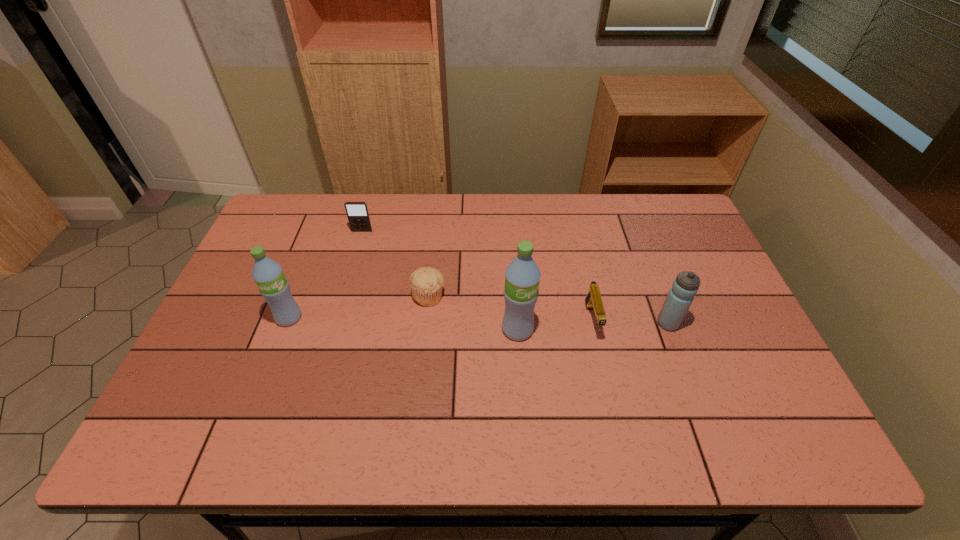
Where is `vacant space that is in between the pistol and the rightmost water bottle`? The height and width of the screenshot is (540, 960). vacant space that is in between the pistol and the rightmost water bottle is located at coordinates (630, 322).

Where is `object that is the closest to the iPod`? The width and height of the screenshot is (960, 540). object that is the closest to the iPod is located at coordinates (426, 283).

At what (x,y) coordinates should I click in order to perform the action: click on the closest object to the farthest object. Please return your answer as a coordinate pair (x, y). Looking at the image, I should click on (426, 283).

What are the coordinates of `water bottle that can be found as the closest to the leftmost object` in the screenshot? It's located at (522, 276).

Identify which water bottle is the third closest to the fourth object from right to left. Please provide its 2D coordinates. Your answer should be formatted as a tuple, i.e. [(x, y)], where the tuple contains the x and y coordinates of a point satisfying the conditions above.

[(681, 295)]

I want to click on blank area in the image that satisfies the following two spatial constraints: 1. on the front-facing side of the fourth object from right to left; 2. on the left side of the third shortest object, so click(x=344, y=295).

Identify the location of blank area in the image that satisfies the following two spatial constraints: 1. on the front-facing side of the second water bottle from left to right; 2. on the left side of the fourth tallest object. (334, 329).

This screenshot has width=960, height=540. I want to click on free spot that satisfies the following two spatial constraints: 1. on the front-facing side of the iPod; 2. on the right side of the rightmost object, so click(335, 323).

I want to click on free point that satisfies the following two spatial constraints: 1. on the front-facing side of the fifth object from right to left; 2. on the right side of the rightmost water bottle, so tap(335, 323).

Find the location of a particular element. This screenshot has width=960, height=540. free space that satisfies the following two spatial constraints: 1. on the back side of the leftmost water bottle; 2. on the right side of the fourth object from right to left is located at coordinates [298, 295].